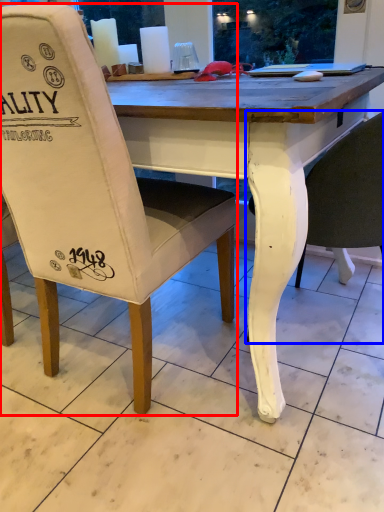
Question: Which object is closer to the camera taking this photo, chair (highlighted by a red box) or chair (highlighted by a blue box)?

Choices:
 (A) chair
 (B) chair

Answer: (A)